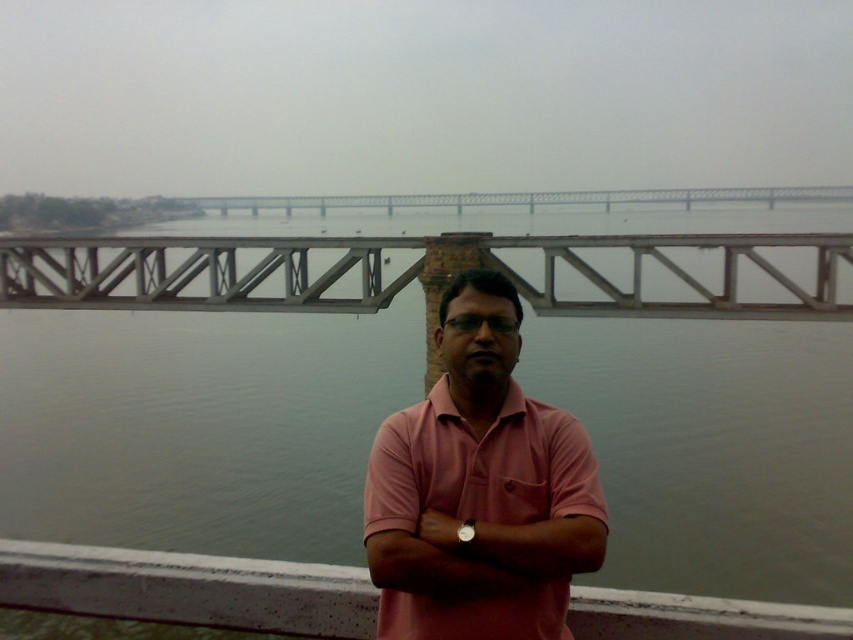
Question: Which point appears closest to the camera in this image?

Choices:
 (A) (531, 476)
 (B) (722, 317)

Answer: (A)

Question: Is pink cotton shirt at center positioned behind metallic gray bridge at upper center?

Choices:
 (A) no
 (B) yes

Answer: (A)

Question: Does pink cotton shirt at center have a greater width compared to metallic gray bridge at upper center?

Choices:
 (A) no
 (B) yes

Answer: (A)

Question: Does pink cotton shirt at center appear on the left side of metallic gray bridge at upper center?

Choices:
 (A) no
 (B) yes

Answer: (B)

Question: Which of the following is the farthest from the observer?

Choices:
 (A) (573, 572)
 (B) (347, 272)

Answer: (B)